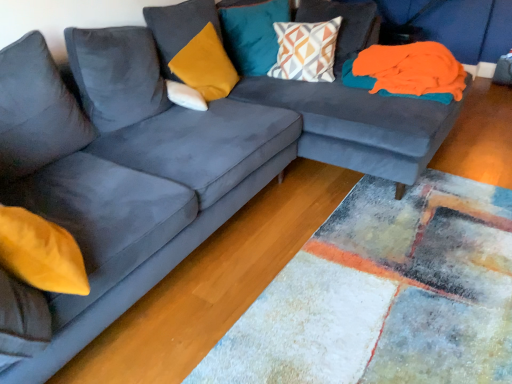
This screenshot has height=384, width=512. What do you see at coordinates (205, 65) in the screenshot?
I see `velvet mustard pillow at upper center, the 3th pillow from the right` at bounding box center [205, 65].

From the picture: Measure the distance between velvet mustard pillow at upper center, the 3th pillow from the right, and camera.

A distance of 7.57 feet exists between velvet mustard pillow at upper center, the 3th pillow from the right, and camera.

At what (x,y) coordinates should I click in order to perform the action: click on orange fabric at upper right. Please return your answer as a coordinate pair (x, y). Image resolution: width=512 pixels, height=384 pixels. Looking at the image, I should click on (407, 71).

The width and height of the screenshot is (512, 384). Describe the element at coordinates (185, 96) in the screenshot. I see `white soft pillow at center, arranged as the fourth pillow when viewed from the right` at that location.

Describe the element at coordinates (306, 50) in the screenshot. I see `geometric-patterned fabric pillow at upper center, arranged as the first pillow when viewed from the right` at that location.

Image resolution: width=512 pixels, height=384 pixels. I want to click on geometric-patterned fabric pillow at upper center, arranged as the first pillow when viewed from the right, so coord(306,50).

Where is `teal velvet cushion at upper center, positioned as the 3th pillow in left-to-right order`? The width and height of the screenshot is (512, 384). teal velvet cushion at upper center, positioned as the 3th pillow in left-to-right order is located at coordinates (253, 34).

Who is more distant, velvet mustard pillow at upper center, the 3th pillow from the right, or white soft pillow at center, the first pillow in the left-to-right sequence?

white soft pillow at center, the first pillow in the left-to-right sequence, is further away from the camera.

Is velvet mustard pillow at upper center, the 3th pillow from the right, inside the boundaries of white soft pillow at center, the first pillow in the left-to-right sequence, or outside?

velvet mustard pillow at upper center, the 3th pillow from the right, is not inside white soft pillow at center, the first pillow in the left-to-right sequence, it's outside.

In the scene shown: From the image's perspective, who appears lower, velvet mustard pillow at upper center, the 3th pillow from the right, or white soft pillow at center, arranged as the fourth pillow when viewed from the right?

white soft pillow at center, arranged as the fourth pillow when viewed from the right.

The width and height of the screenshot is (512, 384). There is a velvet mustard pillow at upper center, marked as the 2th pillow in a left-to-right arrangement. Find the location of `the 1st pillow above it (from a real-world perspective)`. the 1st pillow above it (from a real-world perspective) is located at coordinates (306, 50).

Is velvet mustard pillow at upper center, marked as the 2th pillow in a left-to-right arrangement, far away from geometric-patterned fabric pillow at upper center, which is counted as the 4th pillow, starting from the left?

No.

Is velvet mustard pillow at upper center, the 3th pillow from the right, inside or outside of geometric-patterned fabric pillow at upper center, which is counted as the 4th pillow, starting from the left?

velvet mustard pillow at upper center, the 3th pillow from the right, exists outside the volume of geometric-patterned fabric pillow at upper center, which is counted as the 4th pillow, starting from the left.

In terms of size, does velvet mustard pillow at upper center, marked as the 2th pillow in a left-to-right arrangement, appear bigger or smaller than geometric-patterned fabric pillow at upper center, which is counted as the 4th pillow, starting from the left?

Clearly, velvet mustard pillow at upper center, marked as the 2th pillow in a left-to-right arrangement, is smaller in size than geometric-patterned fabric pillow at upper center, which is counted as the 4th pillow, starting from the left.

Considering the positions of point (289, 29) and point (205, 109), is point (289, 29) closer or farther from the camera than point (205, 109)?

Point (289, 29) is farther from the camera than point (205, 109).

Is geometric-patterned fabric pillow at upper center, which is counted as the 4th pillow, starting from the left, located outside white soft pillow at center, arranged as the fourth pillow when viewed from the right?

Yes, geometric-patterned fabric pillow at upper center, which is counted as the 4th pillow, starting from the left, is not within white soft pillow at center, arranged as the fourth pillow when viewed from the right.

Is geometric-patterned fabric pillow at upper center, which is counted as the 4th pillow, starting from the left, oriented towards white soft pillow at center, the first pillow in the left-to-right sequence?

No, geometric-patterned fabric pillow at upper center, which is counted as the 4th pillow, starting from the left, is not facing towards white soft pillow at center, the first pillow in the left-to-right sequence.

Could you measure the distance between geometric-patterned fabric pillow at upper center, which is counted as the 4th pillow, starting from the left, and white soft pillow at center, the first pillow in the left-to-right sequence?

The distance of geometric-patterned fabric pillow at upper center, which is counted as the 4th pillow, starting from the left, from white soft pillow at center, the first pillow in the left-to-right sequence, is 28.64 inches.

Measure the distance between orange fabric at upper right and geometric-patterned fabric pillow at upper center, which is counted as the 4th pillow, starting from the left.

orange fabric at upper right and geometric-patterned fabric pillow at upper center, which is counted as the 4th pillow, starting from the left, are 14.61 inches apart.

Can you confirm if orange fabric at upper right is taller than geometric-patterned fabric pillow at upper center, arranged as the first pillow when viewed from the right?

No, orange fabric at upper right is not taller than geometric-patterned fabric pillow at upper center, arranged as the first pillow when viewed from the right.

Does point (457, 77) come farther from viewer compared to point (313, 26)?

No.

From the picture: Between orange fabric at upper right and geometric-patterned fabric pillow at upper center, arranged as the first pillow when viewed from the right, which one appears on the left side from the viewer's perspective?

From the viewer's perspective, geometric-patterned fabric pillow at upper center, arranged as the first pillow when viewed from the right, appears more on the left side.

How much distance is there between velvet mustard pillow at upper center, marked as the 2th pillow in a left-to-right arrangement, and orange fabric at upper right?

35.91 inches.

From the picture: From the image's perspective, is velvet mustard pillow at upper center, marked as the 2th pillow in a left-to-right arrangement, located above or below orange fabric at upper right?

From the image's perspective, velvet mustard pillow at upper center, marked as the 2th pillow in a left-to-right arrangement, appears above orange fabric at upper right.

From a real-world perspective, between velvet mustard pillow at upper center, marked as the 2th pillow in a left-to-right arrangement, and orange fabric at upper right, who is vertically lower?

orange fabric at upper right is physically lower.

Which point is more forward, (214, 60) or (398, 64)?

The point (398, 64) is closer.

Is white soft pillow at center, arranged as the fourth pillow when viewed from the right, beside teal velvet cushion at upper center, acting as the second pillow starting from the right?

No.

Is white soft pillow at center, the first pillow in the left-to-right sequence, situated inside teal velvet cushion at upper center, positioned as the 3th pillow in left-to-right order, or outside?

white soft pillow at center, the first pillow in the left-to-right sequence, exists outside the volume of teal velvet cushion at upper center, positioned as the 3th pillow in left-to-right order.

How many degrees apart are the facing directions of white soft pillow at center, the first pillow in the left-to-right sequence, and teal velvet cushion at upper center, acting as the second pillow starting from the right?

78.5 degrees separate the facing orientations of white soft pillow at center, the first pillow in the left-to-right sequence, and teal velvet cushion at upper center, acting as the second pillow starting from the right.

Does white soft pillow at center, the first pillow in the left-to-right sequence, have a greater height compared to teal velvet cushion at upper center, acting as the second pillow starting from the right?

In fact, white soft pillow at center, the first pillow in the left-to-right sequence, may be shorter than teal velvet cushion at upper center, acting as the second pillow starting from the right.

Considering the positions of objects orange fabric at upper right and velvet mustard pillow at upper center, marked as the 2th pillow in a left-to-right arrangement, in the image provided, who is more to the left, orange fabric at upper right or velvet mustard pillow at upper center, marked as the 2th pillow in a left-to-right arrangement,?

Positioned to the left is velvet mustard pillow at upper center, marked as the 2th pillow in a left-to-right arrangement.

In the scene shown: Measure the distance between orange fabric at upper right and velvet mustard pillow at upper center, marked as the 2th pillow in a left-to-right arrangement.

orange fabric at upper right is 35.91 inches from velvet mustard pillow at upper center, marked as the 2th pillow in a left-to-right arrangement.

Considering the positions of points (419, 88) and (192, 85), is point (419, 88) farther from camera compared to point (192, 85)?

That is False.

Considering the sizes of objects orange fabric at upper right and velvet mustard pillow at upper center, the 3th pillow from the right, in the image provided, who is shorter, orange fabric at upper right or velvet mustard pillow at upper center, the 3th pillow from the right,?

orange fabric at upper right.

Identify the location of pillow on the left of velvet mustard pillow at upper center, marked as the 2th pillow in a left-to-right arrangement. Image resolution: width=512 pixels, height=384 pixels. (185, 96).

At what (x,y) coordinates should I click in order to perform the action: click on the 1st pillow above the velvet mustard pillow at upper center, the 3th pillow from the right (from the image's perspective). Please return your answer as a coordinate pair (x, y). The height and width of the screenshot is (384, 512). Looking at the image, I should click on (306, 50).

Based on their spatial positions, is teal velvet cushion at upper center, positioned as the 3th pillow in left-to-right order, or orange fabric at upper right further from geometric-patterned fabric pillow at upper center, which is counted as the 4th pillow, starting from the left?

orange fabric at upper right is positioned further to the anchor geometric-patterned fabric pillow at upper center, which is counted as the 4th pillow, starting from the left.

Estimate the real-world distances between objects in this image. Which object is closer to orange fabric at upper right, geometric-patterned fabric pillow at upper center, which is counted as the 4th pillow, starting from the left, or white soft pillow at center, arranged as the fourth pillow when viewed from the right?

Among the two, geometric-patterned fabric pillow at upper center, which is counted as the 4th pillow, starting from the left, is located nearer to orange fabric at upper right.

Which object lies further to the anchor point velvet mustard pillow at upper center, marked as the 2th pillow in a left-to-right arrangement, teal velvet cushion at upper center, acting as the second pillow starting from the right, or geometric-patterned fabric pillow at upper center, which is counted as the 4th pillow, starting from the left?

geometric-patterned fabric pillow at upper center, which is counted as the 4th pillow, starting from the left, is further to velvet mustard pillow at upper center, marked as the 2th pillow in a left-to-right arrangement.

From the image, which object appears to be nearer to orange fabric at upper right, teal velvet cushion at upper center, acting as the second pillow starting from the right, or geometric-patterned fabric pillow at upper center, which is counted as the 4th pillow, starting from the left?

Based on the image, geometric-patterned fabric pillow at upper center, which is counted as the 4th pillow, starting from the left, appears to be nearer to orange fabric at upper right.

From the picture: Which object lies nearer to the anchor point geometric-patterned fabric pillow at upper center, arranged as the first pillow when viewed from the right, orange fabric at upper right or white soft pillow at center, the first pillow in the left-to-right sequence?

orange fabric at upper right.

Based on their spatial positions, is velvet mustard pillow at upper center, marked as the 2th pillow in a left-to-right arrangement, or white soft pillow at center, arranged as the fourth pillow when viewed from the right, further from teal velvet cushion at upper center, acting as the second pillow starting from the right?

white soft pillow at center, arranged as the fourth pillow when viewed from the right, is positioned further to the anchor teal velvet cushion at upper center, acting as the second pillow starting from the right.

Based on their spatial positions, is white soft pillow at center, the first pillow in the left-to-right sequence, or geometric-patterned fabric pillow at upper center, which is counted as the 4th pillow, starting from the left, further from teal velvet cushion at upper center, acting as the second pillow starting from the right?

Based on the image, white soft pillow at center, the first pillow in the left-to-right sequence, appears to be further to teal velvet cushion at upper center, acting as the second pillow starting from the right.

When comparing their distances from geometric-patterned fabric pillow at upper center, which is counted as the 4th pillow, starting from the left, does velvet mustard pillow at upper center, the 3th pillow from the right, or white soft pillow at center, the first pillow in the left-to-right sequence, seem further?

white soft pillow at center, the first pillow in the left-to-right sequence, lies further to geometric-patterned fabric pillow at upper center, which is counted as the 4th pillow, starting from the left, than the other object.

I want to click on pillow located between velvet mustard pillow at upper center, marked as the 2th pillow in a left-to-right arrangement, and geometric-patterned fabric pillow at upper center, arranged as the first pillow when viewed from the right, in the left-right direction, so click(253, 34).

Image resolution: width=512 pixels, height=384 pixels. Identify the location of pillow situated between teal velvet cushion at upper center, positioned as the 3th pillow in left-to-right order, and orange fabric at upper right from left to right. (306, 50).